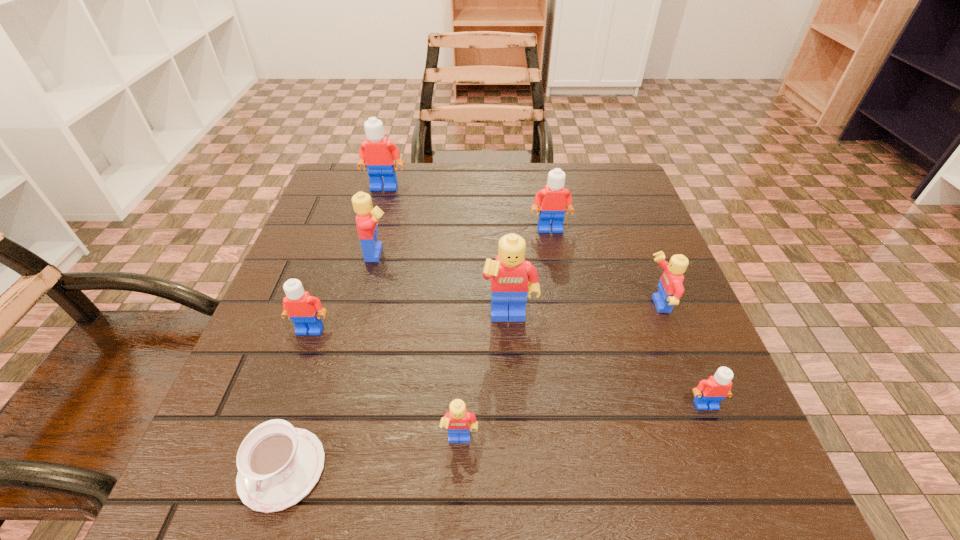
Locate an element on the screen. the biggest yellow Lego is located at coordinates (509, 284).

Identify the location of the fifth Lego from left to right. The height and width of the screenshot is (540, 960). (509, 284).

Find the location of a particular element. The width and height of the screenshot is (960, 540). the farthest Lego is located at coordinates (377, 153).

Identify the location of the farthest white Lego. The height and width of the screenshot is (540, 960). (377, 153).

The height and width of the screenshot is (540, 960). In order to click on the leftmost yellow Lego in this screenshot , I will do `click(367, 218)`.

You are a GUI agent. You are given a task and a screenshot of the screen. Output one action in this format:
    pyautogui.click(x=<x>, y=<y>)
    Task: Click on the second biggest yellow Lego
    Image resolution: width=960 pixels, height=540 pixels.
    Given the screenshot: What is the action you would take?
    pyautogui.click(x=367, y=218)

Locate an element on the screen. the second biggest white Lego is located at coordinates (554, 200).

Where is `the third Lego from right to left`? the third Lego from right to left is located at coordinates (554, 200).

You are a GUI agent. You are given a task and a screenshot of the screen. Output one action in this format:
    pyautogui.click(x=<x>, y=<y>)
    Task: Click on the rightmost yellow Lego
    
    Given the screenshot: What is the action you would take?
    pyautogui.click(x=670, y=285)

The image size is (960, 540). In order to click on the second smallest white Lego in this screenshot , I will do `click(302, 308)`.